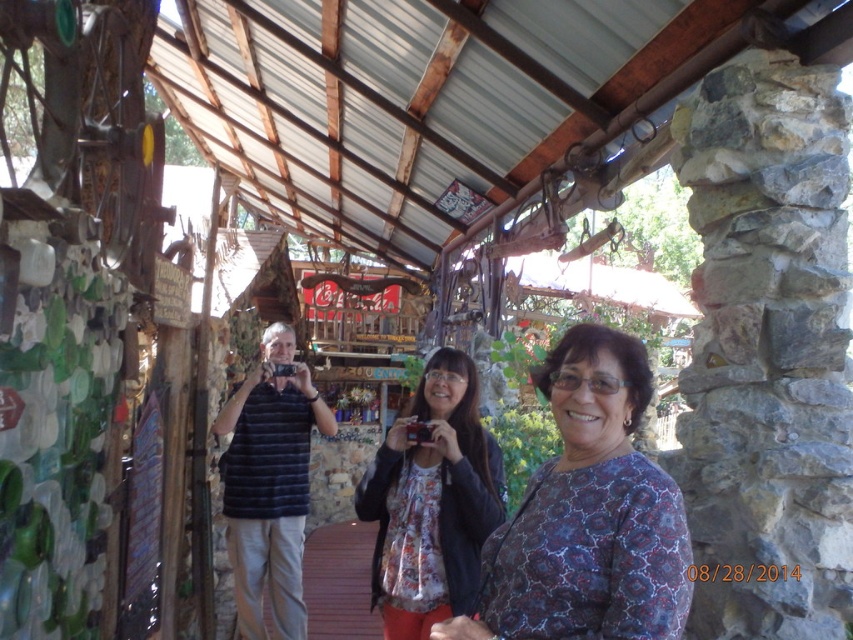
Question: Is blue patterned blouse at center above dark blue striped shirt at center?

Choices:
 (A) yes
 (B) no

Answer: (A)

Question: Which of the following is the farthest from the observer?

Choices:
 (A) (505, 593)
 (B) (265, 435)
 (C) (488, 490)

Answer: (B)

Question: Where is blue patterned blouse at center located in relation to floral fabric blouse at center in the image?

Choices:
 (A) left
 (B) right

Answer: (B)

Question: Among these points, which one is farthest from the camera?

Choices:
 (A) (457, 438)
 (B) (229, 420)
 (C) (538, 582)

Answer: (B)

Question: Does blue patterned blouse at center have a greater width compared to dark blue striped shirt at center?

Choices:
 (A) yes
 (B) no

Answer: (B)

Question: Based on their relative distances, which object is farther from the floral fabric blouse at center?

Choices:
 (A) dark blue striped shirt at center
 (B) blue patterned blouse at center

Answer: (A)